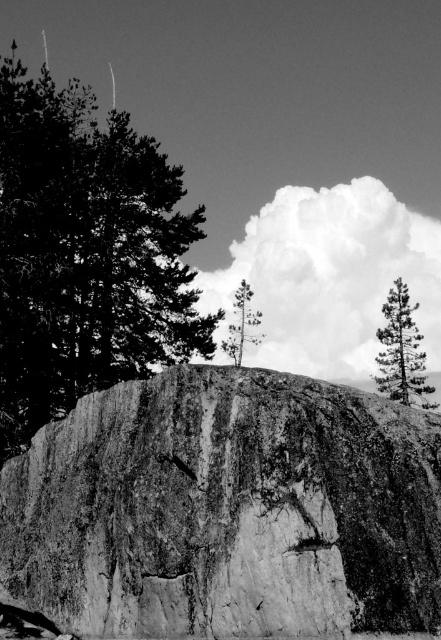
Question: Among these objects, which one is nearest to the camera?

Choices:
 (A) smooth bark tree at upper right
 (B) granite rock at center

Answer: (B)

Question: Where is granite rock at center located in relation to smooth green tree at center in the image?

Choices:
 (A) above
 (B) below

Answer: (B)

Question: Which of the following is the closest to the observer?

Choices:
 (A) (393, 385)
 (B) (273, 566)
 (C) (246, 307)

Answer: (B)

Question: Does granite rock at center lie in front of smooth bark tree at upper right?

Choices:
 (A) no
 (B) yes

Answer: (B)

Question: Which object appears closest to the camera in this image?

Choices:
 (A) smooth green tree at center
 (B) dark green textured tree at upper left
 (C) smooth bark tree at upper right

Answer: (B)

Question: Is smooth bark tree at upper right positioned behind smooth green tree at center?

Choices:
 (A) no
 (B) yes

Answer: (A)